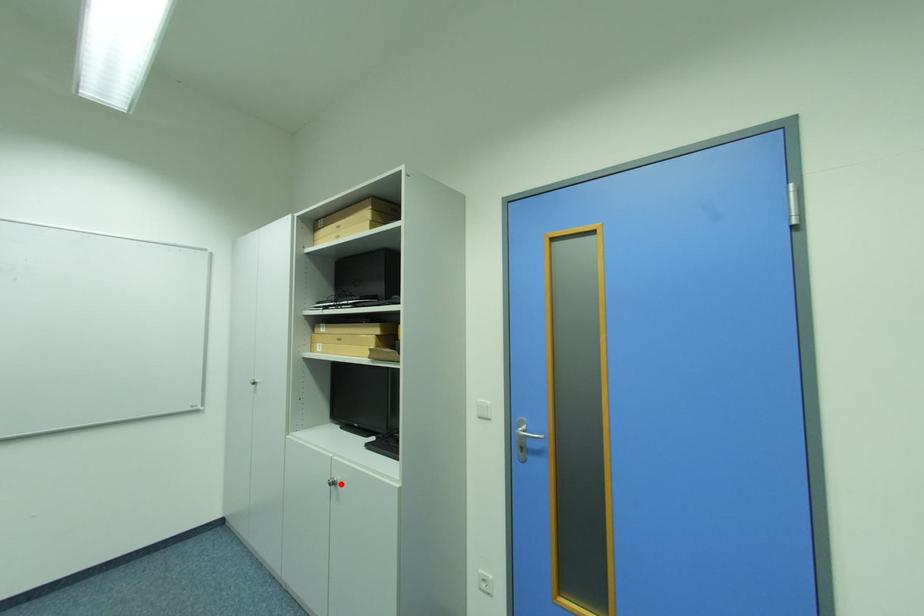
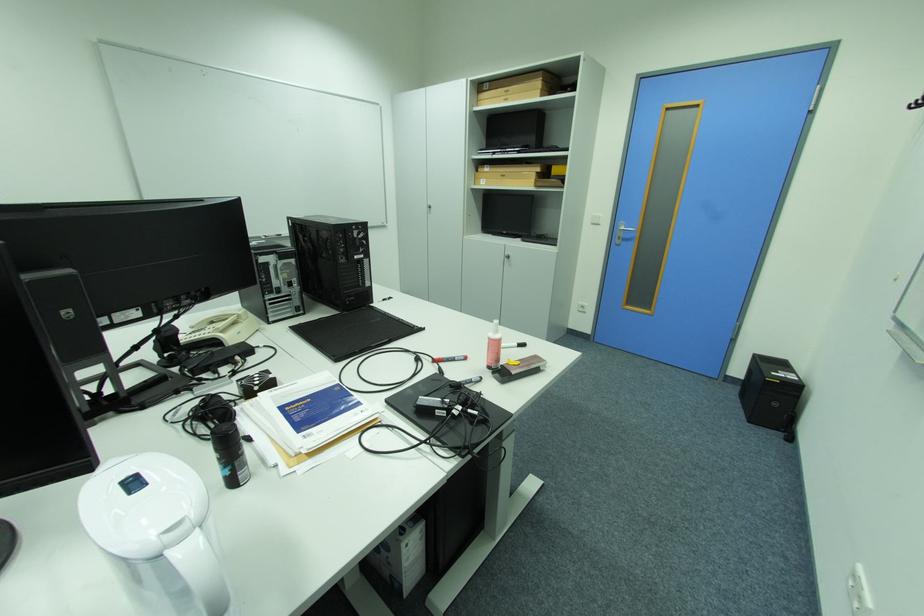
Question: I am providing you with two images of the same scene from different viewpoints. Given a red point in image1, look at the same physical point in image2. Is it:

Choices:
 (A) Closer to the viewpoint
 (B) Farther from the viewpoint

Answer: (A)